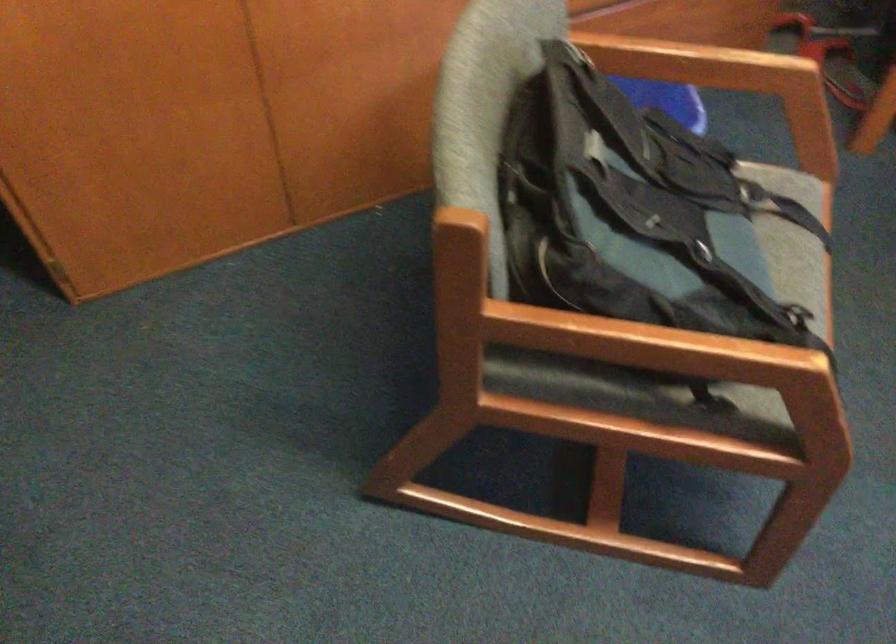
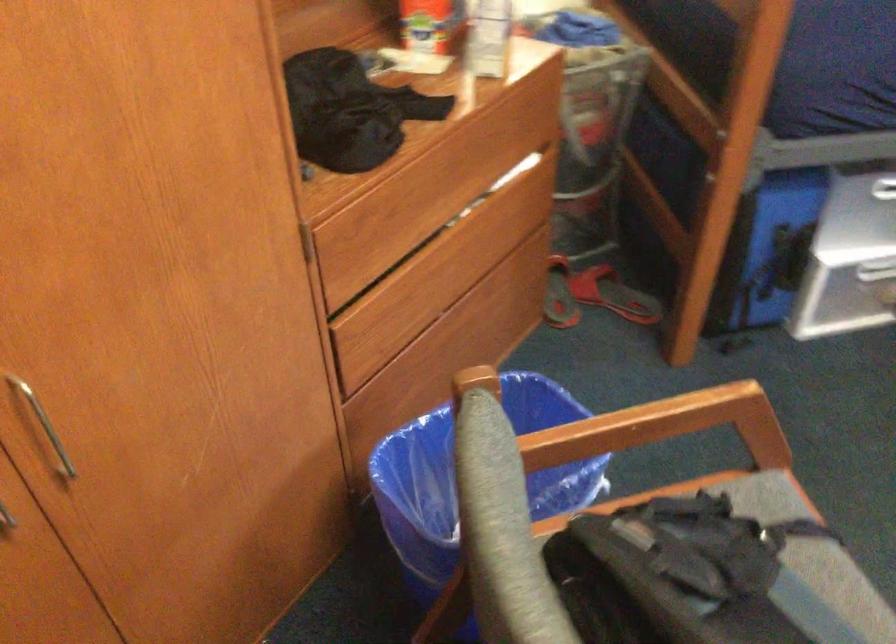
Find the pixel in the second image that matches (x=798, y=203) in the first image.

(769, 504)